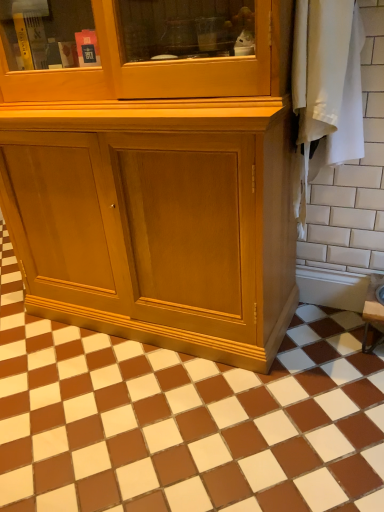
Image resolution: width=384 pixels, height=512 pixels. I want to click on brown glossy tile at center, the first ceramic tile positioned from the bottom, so click(x=185, y=419).

What do you see at coordinates (185, 419) in the screenshot?
I see `brown glossy tile at center, which appears as the second ceramic tile when viewed from the top` at bounding box center [185, 419].

Where is `white ceramic tile at right, acting as the 1th ceramic tile starting from the top`? white ceramic tile at right, acting as the 1th ceramic tile starting from the top is located at coordinates (354, 177).

What do you see at coordinates (354, 177) in the screenshot?
I see `white ceramic tile at right, which is the second ceramic tile in bottom-to-top order` at bounding box center [354, 177].

The width and height of the screenshot is (384, 512). What are the coordinates of `brown glossy tile at center, the 1th ceramic tile positioned from the left` in the screenshot? It's located at (185, 419).

Which is more to the right, white ceramic tile at right, which is the second ceramic tile in bottom-to-top order, or brown glossy tile at center, the second ceramic tile in the right-to-left sequence?

Positioned to the right is white ceramic tile at right, which is the second ceramic tile in bottom-to-top order.

Which is behind, white ceramic tile at right, which is the second ceramic tile from left to right, or brown glossy tile at center, the second ceramic tile in the right-to-left sequence?

white ceramic tile at right, which is the second ceramic tile from left to right, is behind.

Which is farther from the camera, (360, 238) or (197, 372)?

The point (360, 238) is farther.

From the image's perspective, between white ceramic tile at right, which is the second ceramic tile from left to right, and brown glossy tile at center, which appears as the second ceramic tile when viewed from the top, which one is located above?

white ceramic tile at right, which is the second ceramic tile from left to right, is shown above in the image.

From a real-world perspective, who is located lower, white ceramic tile at right, acting as the 1th ceramic tile starting from the top, or brown glossy tile at center, the second ceramic tile in the right-to-left sequence?

brown glossy tile at center, the second ceramic tile in the right-to-left sequence, is physically lower.

Can you confirm if white ceramic tile at right, which is the second ceramic tile in bottom-to-top order, is wider than brown glossy tile at center, which appears as the second ceramic tile when viewed from the top?

In fact, white ceramic tile at right, which is the second ceramic tile in bottom-to-top order, might be narrower than brown glossy tile at center, which appears as the second ceramic tile when viewed from the top.

Considering the sizes of white ceramic tile at right, which is the second ceramic tile from left to right, and brown glossy tile at center, the second ceramic tile in the right-to-left sequence, in the image, is white ceramic tile at right, which is the second ceramic tile from left to right, taller or shorter than brown glossy tile at center, the second ceramic tile in the right-to-left sequence,?

Considering their sizes, white ceramic tile at right, which is the second ceramic tile from left to right, has more height than brown glossy tile at center, the second ceramic tile in the right-to-left sequence.

Based on their sizes in the image, would you say white ceramic tile at right, acting as the 1th ceramic tile starting from the top, is bigger or smaller than brown glossy tile at center, which appears as the second ceramic tile when viewed from the top?

Considering their sizes, white ceramic tile at right, acting as the 1th ceramic tile starting from the top, takes up less space than brown glossy tile at center, which appears as the second ceramic tile when viewed from the top.

Which is correct: white ceramic tile at right, which is the second ceramic tile from left to right, is inside brown glossy tile at center, the first ceramic tile positioned from the bottom, or outside of it?

white ceramic tile at right, which is the second ceramic tile from left to right, lies outside brown glossy tile at center, the first ceramic tile positioned from the bottom.

Looking at this image, is white ceramic tile at right, which is the second ceramic tile from left to right, positioned far away from brown glossy tile at center, the 1th ceramic tile positioned from the left?

white ceramic tile at right, which is the second ceramic tile from left to right, is near brown glossy tile at center, the 1th ceramic tile positioned from the left, not far away.

Could you tell me if white ceramic tile at right, acting as the 1th ceramic tile starting from the top, is turned towards brown glossy tile at center, the second ceramic tile in the right-to-left sequence?

No, white ceramic tile at right, acting as the 1th ceramic tile starting from the top, is not oriented towards brown glossy tile at center, the second ceramic tile in the right-to-left sequence.

Can you tell me how much white ceramic tile at right, acting as the 1th ceramic tile starting from the top, and brown glossy tile at center, the 1th ceramic tile positioned from the left, differ in facing direction?

They differ by 4.57 degrees in their facing directions.

The width and height of the screenshot is (384, 512). In order to click on ceramic tile on the left of white ceramic tile at right, which is the second ceramic tile from left to right in this screenshot , I will do `click(185, 419)`.

Is brown glossy tile at center, the second ceramic tile in the right-to-left sequence, to the right of white ceramic tile at right, which is the second ceramic tile in bottom-to-top order, from the viewer's perspective?

Incorrect, brown glossy tile at center, the second ceramic tile in the right-to-left sequence, is not on the right side of white ceramic tile at right, which is the second ceramic tile in bottom-to-top order.

Does brown glossy tile at center, the first ceramic tile positioned from the bottom, come in front of white ceramic tile at right, acting as the 1th ceramic tile starting from the top?

Yes, it is.

Is point (318, 422) closer or farther from the camera than point (380, 212)?

Clearly, point (318, 422) is closer to the camera than point (380, 212).

From the image's perspective, is brown glossy tile at center, the 1th ceramic tile positioned from the left, on top of white ceramic tile at right, which is the second ceramic tile from left to right?

Incorrect, from the image's perspective, brown glossy tile at center, the 1th ceramic tile positioned from the left, is lower than white ceramic tile at right, which is the second ceramic tile from left to right.

From a real-world perspective, is brown glossy tile at center, the first ceramic tile positioned from the bottom, positioned over white ceramic tile at right, which is the second ceramic tile in bottom-to-top order, based on gravity?

No, from a real-world perspective, brown glossy tile at center, the first ceramic tile positioned from the bottom, is not over white ceramic tile at right, which is the second ceramic tile in bottom-to-top order

In terms of width, does brown glossy tile at center, the first ceramic tile positioned from the bottom, look wider or thinner when compared to white ceramic tile at right, which is the second ceramic tile from left to right?

brown glossy tile at center, the first ceramic tile positioned from the bottom, is wider than white ceramic tile at right, which is the second ceramic tile from left to right.

Considering the relative sizes of brown glossy tile at center, the second ceramic tile in the right-to-left sequence, and white ceramic tile at right, acting as the 1th ceramic tile starting from the top, in the image provided, is brown glossy tile at center, the second ceramic tile in the right-to-left sequence, taller than white ceramic tile at right, acting as the 1th ceramic tile starting from the top,?

Incorrect, the height of brown glossy tile at center, the second ceramic tile in the right-to-left sequence, is not larger of that of white ceramic tile at right, acting as the 1th ceramic tile starting from the top.

Considering the sizes of brown glossy tile at center, which appears as the second ceramic tile when viewed from the top, and white ceramic tile at right, which is the second ceramic tile from left to right, in the image, is brown glossy tile at center, which appears as the second ceramic tile when viewed from the top, bigger or smaller than white ceramic tile at right, which is the second ceramic tile from left to right,?

Considering their sizes, brown glossy tile at center, which appears as the second ceramic tile when viewed from the top, takes up more space than white ceramic tile at right, which is the second ceramic tile from left to right.

Is white ceramic tile at right, which is the second ceramic tile from left to right, surrounded by brown glossy tile at center, the 1th ceramic tile positioned from the left?

No, white ceramic tile at right, which is the second ceramic tile from left to right, is not a part of brown glossy tile at center, the 1th ceramic tile positioned from the left.

Is brown glossy tile at center, the first ceramic tile positioned from the bottom, in contact with white ceramic tile at right, which is the second ceramic tile in bottom-to-top order?

No, brown glossy tile at center, the first ceramic tile positioned from the bottom, is not touching white ceramic tile at right, which is the second ceramic tile in bottom-to-top order.

Is brown glossy tile at center, the second ceramic tile in the right-to-left sequence, oriented towards white ceramic tile at right, acting as the 1th ceramic tile starting from the top?

No, brown glossy tile at center, the second ceramic tile in the right-to-left sequence, does not turn towards white ceramic tile at right, acting as the 1th ceramic tile starting from the top.

Measure the distance from brown glossy tile at center, the second ceramic tile in the right-to-left sequence, to white ceramic tile at right, which is the second ceramic tile from left to right.

brown glossy tile at center, the second ceramic tile in the right-to-left sequence, is 26.11 inches from white ceramic tile at right, which is the second ceramic tile from left to right.

At what (x,y) coordinates should I click in order to perform the action: click on ceramic tile that is above the brown glossy tile at center, which appears as the second ceramic tile when viewed from the top (from a real-world perspective). Please return your answer as a coordinate pair (x, y). The image size is (384, 512). Looking at the image, I should click on (354, 177).

Identify the location of ceramic tile above the brown glossy tile at center, which appears as the second ceramic tile when viewed from the top (from a real-world perspective). The image size is (384, 512). (354, 177).

Where is `ceramic tile behind the brown glossy tile at center, which appears as the second ceramic tile when viewed from the top`? ceramic tile behind the brown glossy tile at center, which appears as the second ceramic tile when viewed from the top is located at coordinates (354, 177).